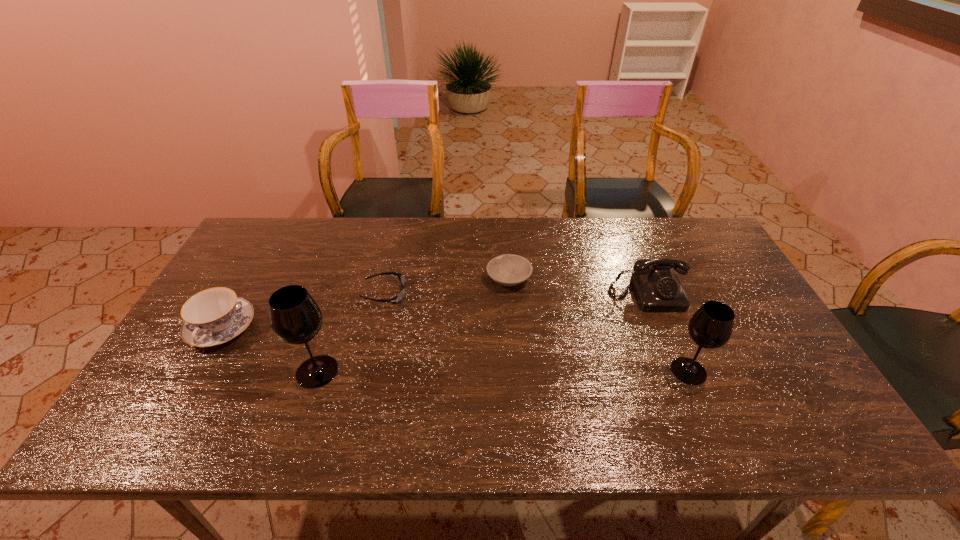
You are a GUI agent. You are given a task and a screenshot of the screen. Output one action in this format:
    pyautogui.click(x=<x>, y=<y>)
    Task: Click on the vacant region at the left edge
    
    Given the screenshot: What is the action you would take?
    pyautogui.click(x=237, y=349)

Image resolution: width=960 pixels, height=540 pixels. In order to click on empty location between the leftmost object and the telephone in this screenshot , I will do `click(434, 312)`.

Image resolution: width=960 pixels, height=540 pixels. I want to click on empty space that is in between the third object from left to right and the bowl, so [x=447, y=286].

Where is `vacant space in between the shortest object and the taller wineglass`? Image resolution: width=960 pixels, height=540 pixels. vacant space in between the shortest object and the taller wineglass is located at coordinates (351, 333).

Find the location of `free space between the shortest object and the right wineglass`. free space between the shortest object and the right wineglass is located at coordinates (537, 332).

Where is `empty space between the leftmost object and the shorter wineglass`? empty space between the leftmost object and the shorter wineglass is located at coordinates (455, 349).

I want to click on free spot between the third shortest object and the fourth object from left to right, so pyautogui.click(x=365, y=303).

The width and height of the screenshot is (960, 540). Identify the location of empty location between the shortest object and the second tallest object. (537, 332).

The image size is (960, 540). Find the location of `vacant area that lies between the fifth object from right to left and the second tallest object`. vacant area that lies between the fifth object from right to left and the second tallest object is located at coordinates click(503, 371).

At what (x,y) coordinates should I click in order to perform the action: click on vacant region between the bowl and the shortest object. Please return your answer as a coordinate pair (x, y). Looking at the image, I should click on (447, 286).